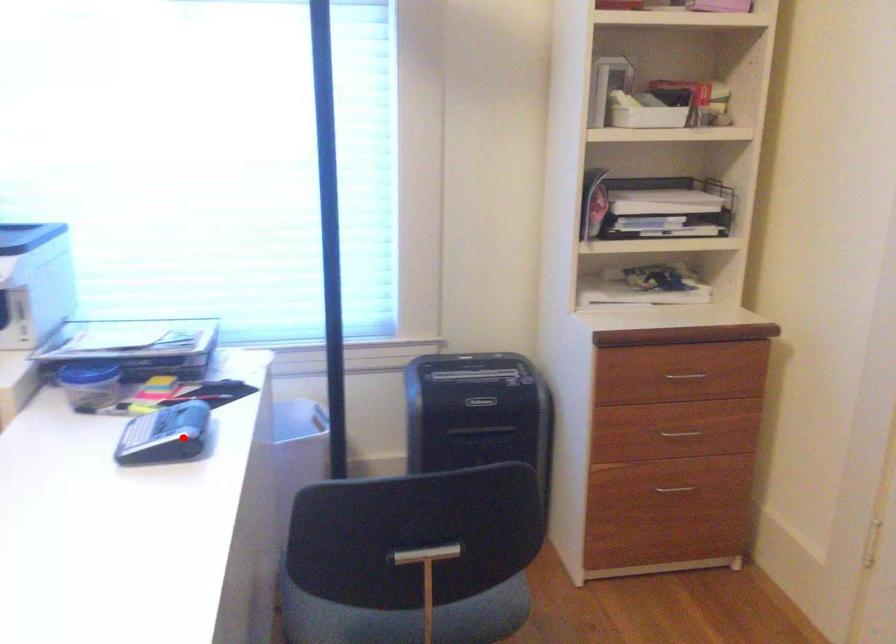
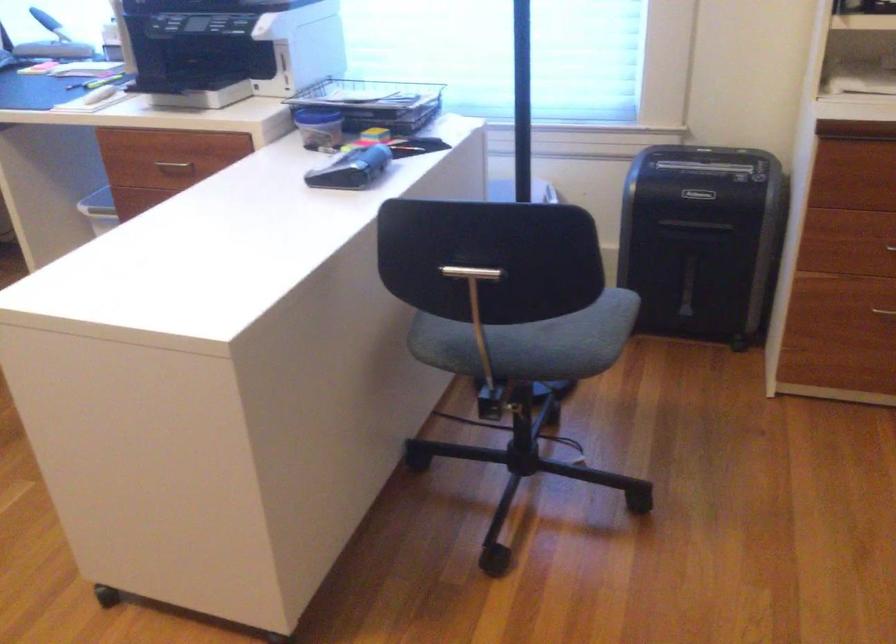
Find the pixel in the second image that matches the highlighted location in the first image.

(351, 169)